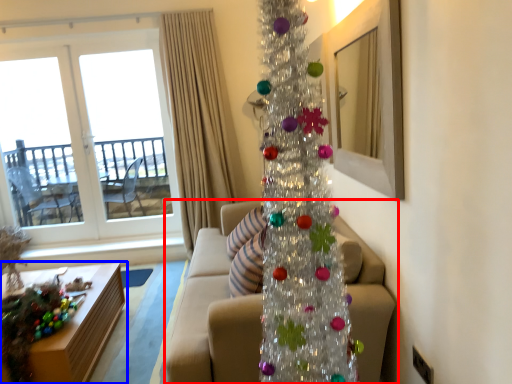
Question: Among these objects, which one is nearest to the camera, studio couch (highlighted by a red box) or table (highlighted by a blue box)?

Choices:
 (A) studio couch
 (B) table

Answer: (A)